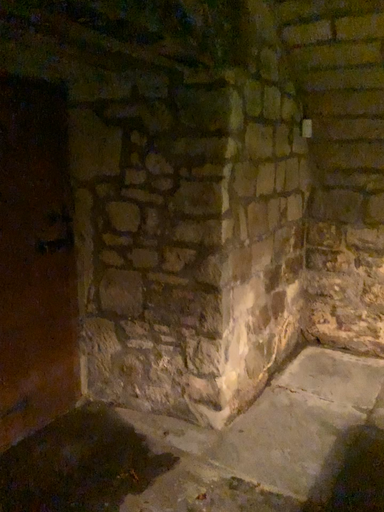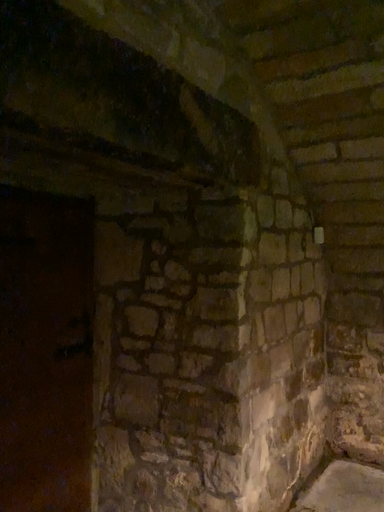
Question: Which way did the camera rotate in the video?

Choices:
 (A) rotated upward
 (B) rotated downward

Answer: (A)